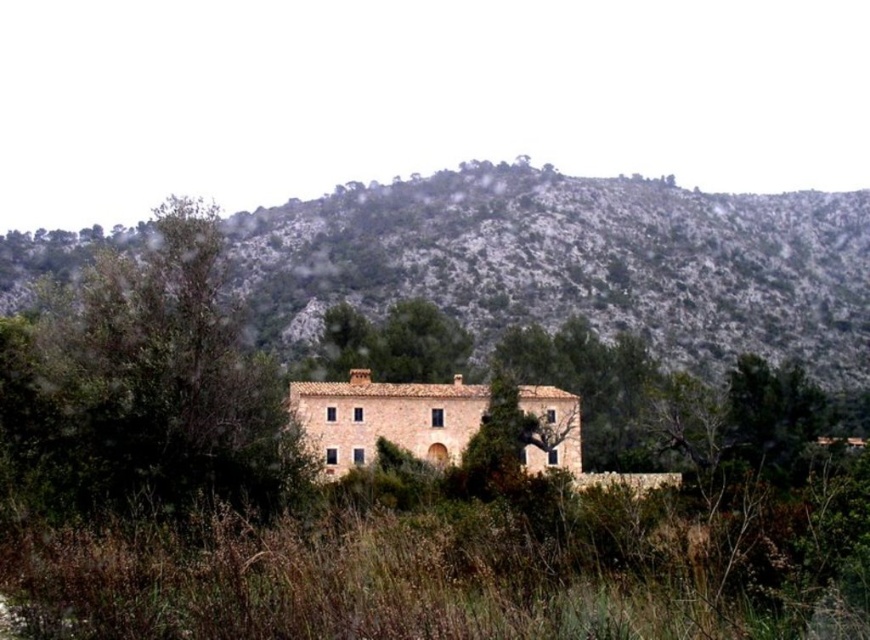
You are standing in front of the rustic stone house and want to determine the relative positions of two points marked in the scene. Specifically, you need to know which point is closer to you. The points are labeled as point 1 at coordinates point (857, 321) and point 2 at coordinates point (0, 444). Based on the scene description, which point is closer to you?

Point (0, 444) is closer to you because it is positioned further away from the viewer compared to point (857, 321), which is closer.

You are a hiker planning a route between the green mossy hillside at center and the green leafy tree at center. Given that your average walking speed is 3 km per hour, how long would it take you to walk directly between them?

The distance between the green mossy hillside at center and the green leafy tree at center is 127.90 meters. Converting meters to kilometers, that is 0.1279 km. Dividing the distance by your speed of 3 km per hour gives approximately 0.0426 hours. Multiplying this by 60 minutes per hour, the time required is roughly 2.56 minutes. Therefore, it would take about 2.6 minutes to walk between them.

You are standing at the entrance of the rustic stone house and want to reach the green mossy hillside at center. According to the coordinates provided, in which direction should you head from the house to reach the hillside?

The green mossy hillside at center is located at coordinates point (574, 262). Based on standard coordinate systems, this places it slightly to the right and above the center point, so you should head towards the upper right direction from the house to reach it.